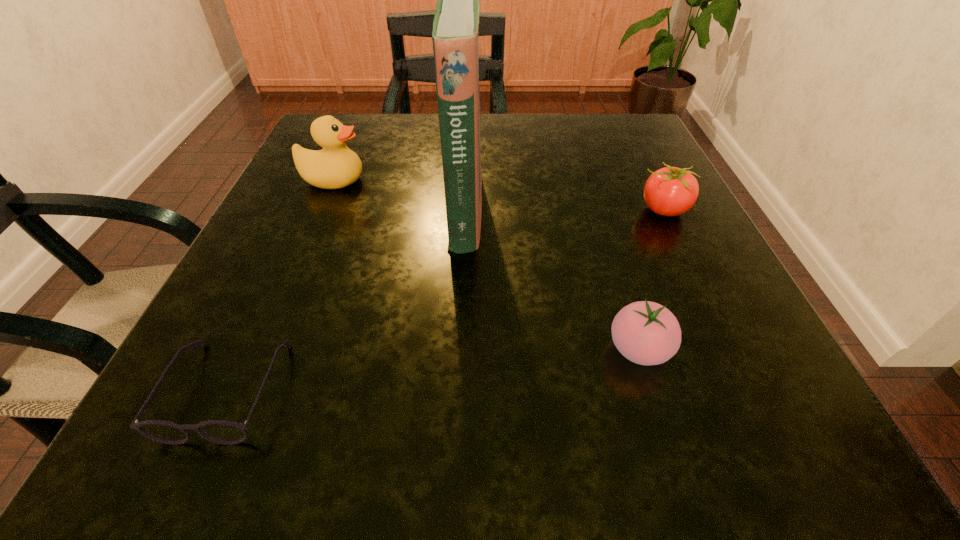
Find the location of a particular element. blank region between the hardback book and the farther tomato is located at coordinates (564, 210).

Where is `vacant area that lies between the second object from right to left and the duck`? This screenshot has height=540, width=960. vacant area that lies between the second object from right to left and the duck is located at coordinates (486, 265).

What are the coordinates of `vacant space that's between the spectacles and the fourth object from left to right` in the screenshot? It's located at (433, 369).

Where is `object that can be found as the fourth closest to the tallest object`? This screenshot has height=540, width=960. object that can be found as the fourth closest to the tallest object is located at coordinates (670, 191).

Where is `the third closest object to the nearer tomato`? This screenshot has height=540, width=960. the third closest object to the nearer tomato is located at coordinates (218, 431).

The height and width of the screenshot is (540, 960). I want to click on free space in the image that satisfies the following two spatial constraints: 1. at the beak of the duck; 2. on the front-facing side of the shortest object, so click(244, 389).

Identify the location of free spot that satisfies the following two spatial constraints: 1. at the beak of the duck; 2. on the right side of the rightmost object. (321, 210).

Image resolution: width=960 pixels, height=540 pixels. I want to click on vacant point that satisfies the following two spatial constraints: 1. on the cover of the hardback book; 2. on the front-facing side of the shortest object, so click(x=458, y=389).

At what (x,y) coordinates should I click in order to perform the action: click on free spot that satisfies the following two spatial constraints: 1. at the beak of the fourth shortest object; 2. on the left side of the nearer tomato. Please return your answer as a coordinate pair (x, y). The height and width of the screenshot is (540, 960). Looking at the image, I should click on (261, 349).

Find the location of `vacant area that satisfies the following two spatial constraints: 1. at the beak of the second tallest object; 2. on the right side of the left tomato`. vacant area that satisfies the following two spatial constraints: 1. at the beak of the second tallest object; 2. on the right side of the left tomato is located at coordinates (261, 349).